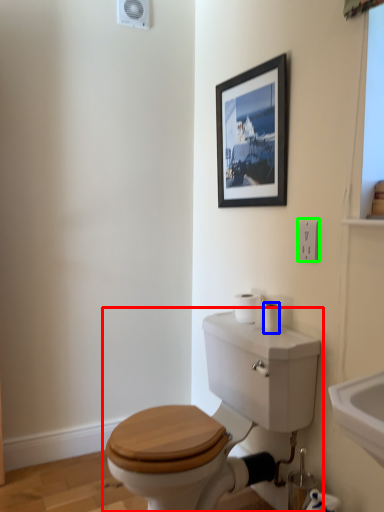
Question: Which object is the closest to the toilet (highlighted by a red box)? Choose among these: toilet paper (highlighted by a blue box) or electric outlet (highlighted by a green box).

Choices:
 (A) toilet paper
 (B) electric outlet

Answer: (A)